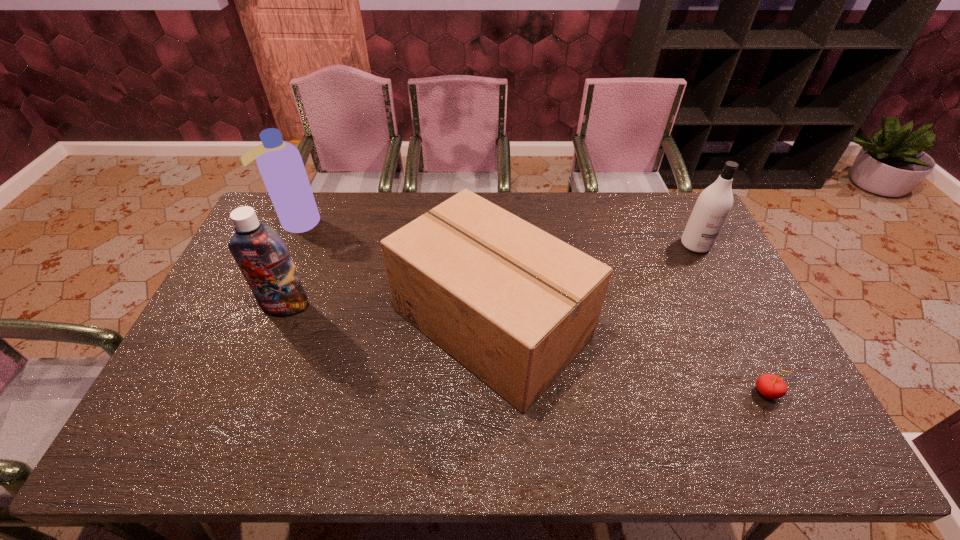
Where is `the nearest shampoo`? the nearest shampoo is located at coordinates (260, 253).

Image resolution: width=960 pixels, height=540 pixels. Find the location of `the rightmost shampoo`. the rightmost shampoo is located at coordinates (714, 204).

Where is `box`? This screenshot has width=960, height=540. box is located at coordinates (513, 304).

Where is `cherry`? This screenshot has width=960, height=540. cherry is located at coordinates (771, 386).

Locate an element on the screen. Image resolution: width=960 pixels, height=540 pixels. free spot located 0.170m on the front label of the nearest shampoo is located at coordinates (x=261, y=367).

Locate an element on the screen. The height and width of the screenshot is (540, 960). free region located on the front-facing side of the rightmost shampoo is located at coordinates (728, 308).

The height and width of the screenshot is (540, 960). In order to click on free location located on the left of the box in this screenshot , I will do `click(375, 323)`.

This screenshot has height=540, width=960. I want to click on vacant area located 0.400m on the left of the cherry, so click(x=596, y=392).

At what (x,y) coordinates should I click in order to perform the action: click on object that is at the far edge. Please return your answer as a coordinate pair (x, y). The height and width of the screenshot is (540, 960). Looking at the image, I should click on (280, 164).

Find the location of a particular element. Image resolution: width=960 pixels, height=540 pixels. shampoo that is at the right edge is located at coordinates (714, 204).